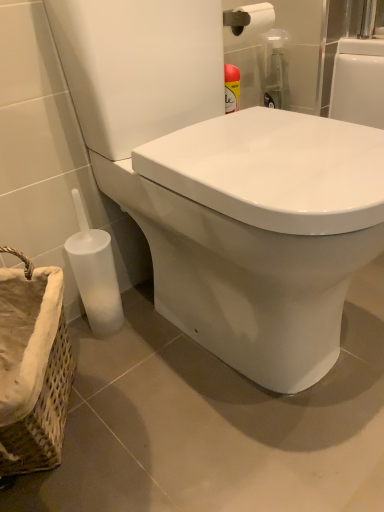
Question: Is white glossy toilet at lower left facing away from woven fabric basket at lower left?

Choices:
 (A) no
 (B) yes

Answer: (A)

Question: Is white glossy toilet at lower left closer to the viewer compared to woven fabric basket at lower left?

Choices:
 (A) yes
 (B) no

Answer: (A)

Question: Would you consider white glossy toilet at lower left to be distant from woven fabric basket at lower left?

Choices:
 (A) yes
 (B) no

Answer: (B)

Question: Does white glossy toilet at lower left appear on the left side of woven fabric basket at lower left?

Choices:
 (A) yes
 (B) no

Answer: (B)

Question: Is white glossy toilet at lower left shorter than woven fabric basket at lower left?

Choices:
 (A) yes
 (B) no

Answer: (B)

Question: Is white glossy toilet at lower left wider than woven fabric basket at lower left?

Choices:
 (A) yes
 (B) no

Answer: (A)

Question: From the image's perspective, is white matte toilet brush at lower left on top of woven fabric basket at lower left?

Choices:
 (A) yes
 (B) no

Answer: (A)

Question: Is white matte toilet brush at lower left not within woven fabric basket at lower left?

Choices:
 (A) no
 (B) yes

Answer: (B)

Question: Is white matte toilet brush at lower left shorter than woven fabric basket at lower left?

Choices:
 (A) no
 (B) yes

Answer: (A)

Question: Is woven fabric basket at lower left at the back of white matte toilet brush at lower left?

Choices:
 (A) no
 (B) yes

Answer: (A)

Question: Considering the relative sizes of white matte toilet brush at lower left and woven fabric basket at lower left in the image provided, is white matte toilet brush at lower left thinner than woven fabric basket at lower left?

Choices:
 (A) yes
 (B) no

Answer: (A)

Question: Does white matte toilet brush at lower left lie in front of woven fabric basket at lower left?

Choices:
 (A) no
 (B) yes

Answer: (A)

Question: Is woven fabric basket at lower left bigger than white matte toilet brush at lower left?

Choices:
 (A) yes
 (B) no

Answer: (A)